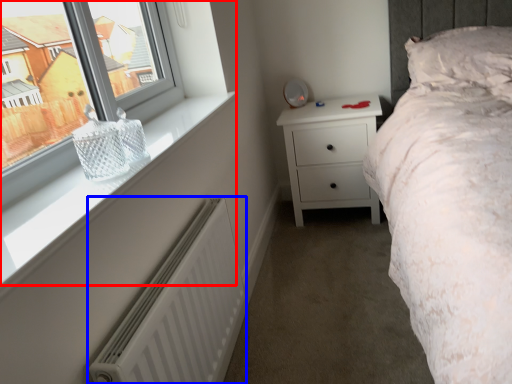
Question: Which of the following is the farthest to the observer, window (highlighted by a red box) or radiator (highlighted by a blue box)?

Choices:
 (A) window
 (B) radiator

Answer: (B)